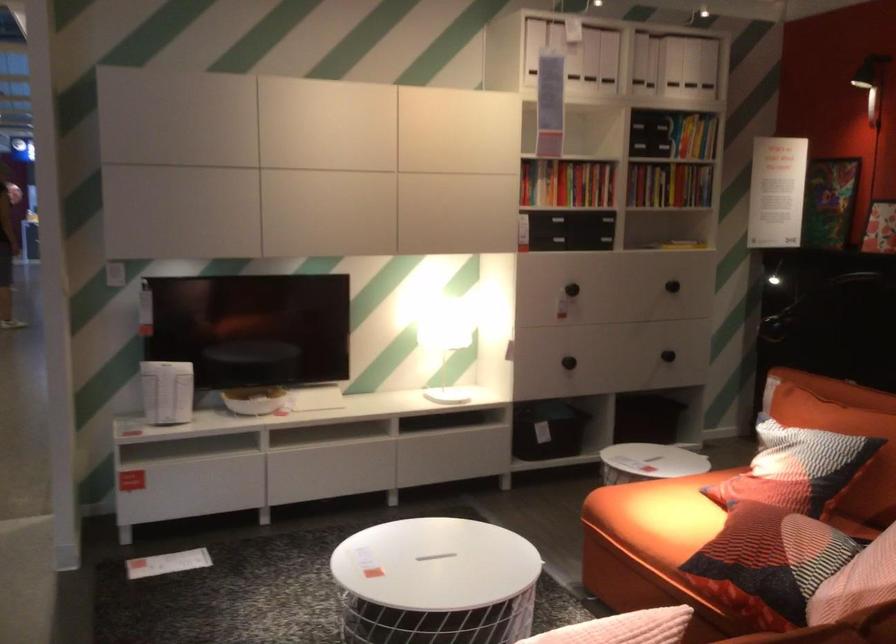
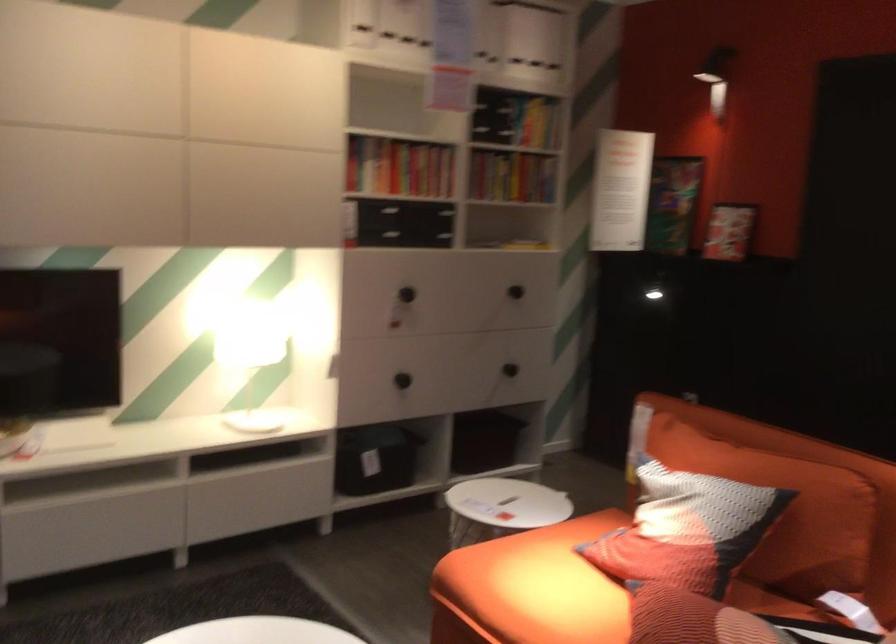
Question: The camera is either moving clockwise (left) or counter-clockwise (right) around the object. The first image is from the beginning of the video and the second image is from the end. Is the camera moving left or right when shooting the video?

Choices:
 (A) Left
 (B) Right

Answer: (A)